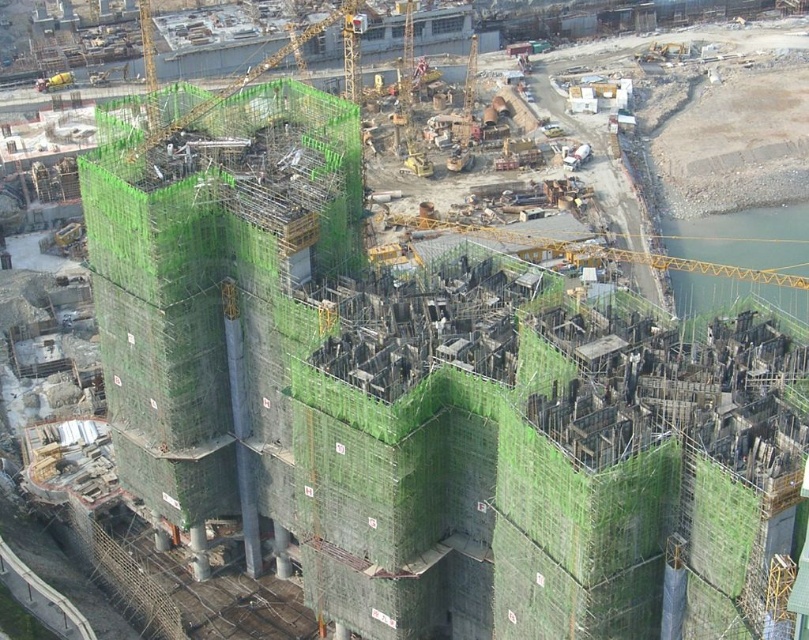
Question: Can you confirm if yellow metal crane at upper right is positioned to the left of green mesh scaffolding at upper center?

Choices:
 (A) no
 (B) yes

Answer: (A)

Question: Based on their relative distances, which object is farther from the green netting at center?

Choices:
 (A) green mesh scaffolding at upper center
 (B) yellow metal crane at upper right

Answer: (B)

Question: Which object is farther from the camera taking this photo?

Choices:
 (A) green netting at center
 (B) green mesh scaffolding at upper center
 (C) yellow metal crane at upper right

Answer: (C)

Question: Which object is closer to the camera taking this photo?

Choices:
 (A) green mesh scaffolding at upper center
 (B) green netting at center

Answer: (B)

Question: Does green netting at center come behind green mesh scaffolding at upper center?

Choices:
 (A) no
 (B) yes

Answer: (A)

Question: Does green netting at center lie in front of yellow metal crane at upper right?

Choices:
 (A) yes
 (B) no

Answer: (A)